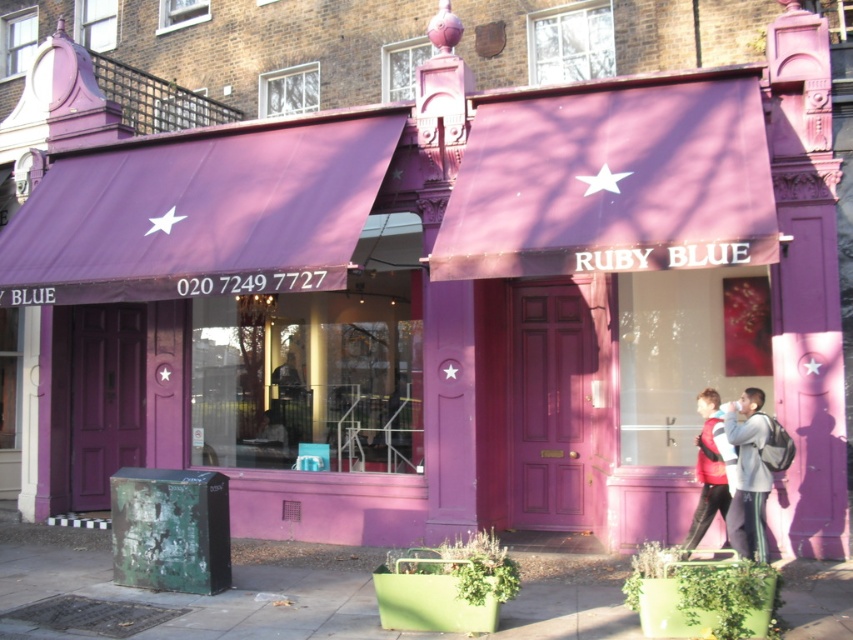
You are a customer looking at the gray fabric jacket at center displayed in the transparent glass shop window at center. Can you see the jacket clearly through the window?

The transparent glass shop window at center is positioned over the gray fabric jacket at center, so yes, the jacket can be seen clearly through the window.

You are standing in front of the Ruby Blue shop and want to see the gray fabric jacket at center through the transparent glass shop window at center. Can you see it clearly?

The transparent glass shop window at center is further to the viewer than gray fabric jacket at center, so the jacket is behind the window. Since the window is transparent, you can see the gray fabric jacket at center clearly through it.

You are standing in front of the Ruby Blue shop and want to take a photo. You notice two points marked on the shop facade. Which point, point 1 at coordinates (189, 625) or point 2 at coordinates (767, 435), will appear larger in your camera view?

Point 1 at coordinates (189, 625) will appear larger in the camera view because it is closer to the camera than point 2 at coordinates (767, 435).